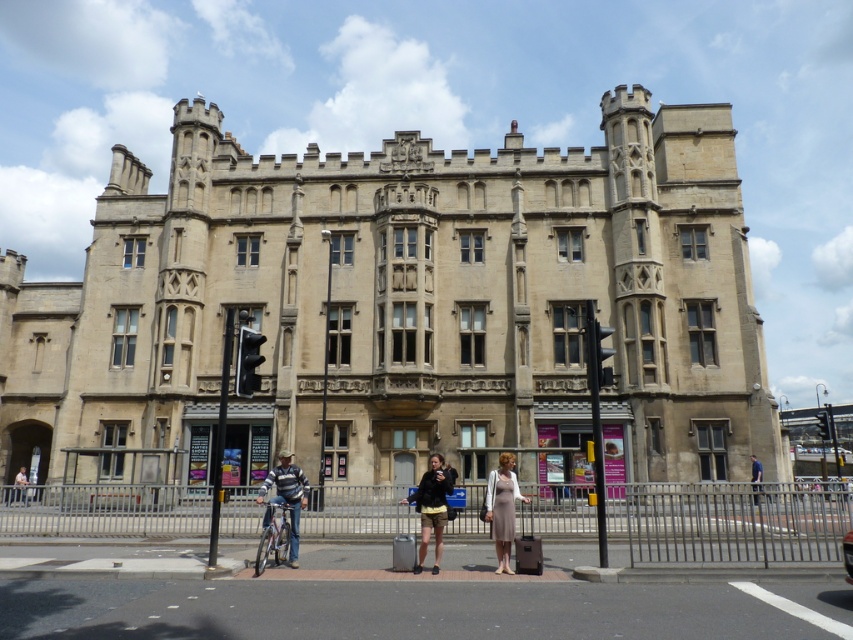
Does light beige dress at center appear on the left side of striped sweater at center?

In fact, light beige dress at center is to the right of striped sweater at center.

Is light beige dress at center smaller than striped sweater at center?

Correct, light beige dress at center occupies less space than striped sweater at center.

What do you see at coordinates (502, 508) in the screenshot? The height and width of the screenshot is (640, 853). I see `light beige dress at center` at bounding box center [502, 508].

Image resolution: width=853 pixels, height=640 pixels. Find the location of `light beige dress at center`. light beige dress at center is located at coordinates (502, 508).

Based on the photo, can you confirm if light beige dress at center is positioned to the right of light brown leather jacket at lower left?

Correct, you'll find light beige dress at center to the right of light brown leather jacket at lower left.

Between point (505, 464) and point (19, 484), which one is positioned behind?

The point (19, 484) is behind.

Where is `light beige dress at center`? light beige dress at center is located at coordinates (502, 508).

Where is `light beige dress at center`? This screenshot has width=853, height=640. light beige dress at center is located at coordinates (502, 508).

I want to click on dark brown leather jacket at center, so click(x=432, y=506).

From the picture: Who is more distant from viewer, (x=450, y=490) or (x=846, y=564)?

Point (x=450, y=490)

This screenshot has height=640, width=853. Identify the location of dark brown leather jacket at center. (432, 506).